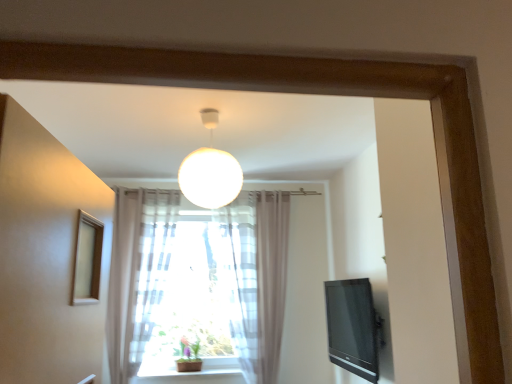
Measure the distance between black glossy tv at right and camera.

A distance of 3.31 meters exists between black glossy tv at right and camera.

Measure the distance between white matte sphere at center and camera.

The depth of white matte sphere at center is 7.97 feet.

Locate an element on the screen. black glossy tv at right is located at coordinates (352, 327).

Considering the relative sizes of black glossy tv at right and translucent fabric curtain at lower center in the image provided, is black glossy tv at right shorter than translucent fabric curtain at lower center?

Yes, black glossy tv at right is shorter than translucent fabric curtain at lower center.

How different are the orientations of black glossy tv at right and translucent fabric curtain at lower center in degrees?

90 degrees separate the facing orientations of black glossy tv at right and translucent fabric curtain at lower center.

Is the surface of black glossy tv at right in direct contact with translucent fabric curtain at lower center?

No, black glossy tv at right is not making contact with translucent fabric curtain at lower center.

Which point is more forward, (362,342) or (240,186)?

The point (240,186) is more forward.

Which object is further away from the camera, black glossy tv at right or white matte sphere at center?

black glossy tv at right is further away from the camera.

From the picture: From the image's perspective, does black glossy tv at right appear higher than white matte sphere at center?

No, from the image's perspective, black glossy tv at right is not on top of white matte sphere at center.

Measure the distance from black glossy tv at right to white matte sphere at center.

black glossy tv at right and white matte sphere at center are 6.28 feet apart.

Which object is thinner, green matte plant at center or translucent fabric curtain at lower center?

With smaller width is green matte plant at center.

Is translucent fabric curtain at lower center at the back of green matte plant at center?

No, green matte plant at center is not facing the opposite direction of translucent fabric curtain at lower center.

Image resolution: width=512 pixels, height=384 pixels. Find the location of `plant on the right of translucent fabric curtain at lower center`. plant on the right of translucent fabric curtain at lower center is located at coordinates (189, 351).

Relative to translucent fabric curtain at lower center, is green matte plant at center in front or behind?

green matte plant at center is behind translucent fabric curtain at lower center.

Is green matte plant at center touching white matte sphere at center?

No, green matte plant at center is not in contact with white matte sphere at center.

Between green matte plant at center and white matte sphere at center, which one has larger width?

With larger width is white matte sphere at center.

From a real-world perspective, is green matte plant at center physically above white matte sphere at center?

No, from a real-world perspective, green matte plant at center is not over white matte sphere at center

Does point (182, 340) come in front of point (205, 124)?

No, (182, 340) is behind (205, 124).

Is white matte sphere at center inside or outside of green matte plant at center?

white matte sphere at center is not enclosed by green matte plant at center.

Is white matte sphere at center further to camera compared to green matte plant at center?

No, the depth of white matte sphere at center is less than that of green matte plant at center.

From the image's perspective, relative to green matte plant at center, is white matte sphere at center above or below?

Based on their image positions, white matte sphere at center is located above green matte plant at center.

Which is in front, point (184, 170) or point (195, 342)?

Point (184, 170)

From the image's perspective, does translucent fabric curtain at lower center appear higher than green matte plant at center?

Correct, translucent fabric curtain at lower center appears higher than green matte plant at center in the image.

Is translucent fabric curtain at lower center smaller than green matte plant at center?

No, translucent fabric curtain at lower center is not smaller than green matte plant at center.

Is translucent fabric curtain at lower center outside of green matte plant at center?

Yes, translucent fabric curtain at lower center is not within green matte plant at center.

Could you tell me if white matte sphere at center is facing translucent fabric curtain at lower center?

No, white matte sphere at center is not aimed at translucent fabric curtain at lower center.

Which is more to the right, white matte sphere at center or translucent fabric curtain at lower center?

Positioned to the right is white matte sphere at center.

Is white matte sphere at center placed right next to translucent fabric curtain at lower center?

white matte sphere at center and translucent fabric curtain at lower center are not in contact.

You are a GUI agent. You are given a task and a screenshot of the screen. Output one action in this format:
    pyautogui.click(x=<x>, y=<y>)
    Task: Click on the curtain located on the left of black glossy tv at right
    
    Given the screenshot: What is the action you would take?
    pyautogui.click(x=138, y=273)

Locate an element on the screen. The width and height of the screenshot is (512, 384). lamp above the black glossy tv at right (from the image's perspective) is located at coordinates pos(210,171).

From the image, which object appears to be farther from green matte plant at center, translucent fabric curtain at lower center or white matte sphere at center?

Based on the image, white matte sphere at center appears to be further to green matte plant at center.

Looking at this image, from the image, which object appears to be nearer to green matte plant at center, black glossy tv at right or translucent fabric curtain at lower center?

translucent fabric curtain at lower center lies closer to green matte plant at center than the other object.

When comparing their distances from black glossy tv at right, does white matte sphere at center or translucent fabric curtain at lower center seem further?

white matte sphere at center lies further to black glossy tv at right than the other object.

Based on their spatial positions, is black glossy tv at right or translucent fabric curtain at lower center further from white matte sphere at center?

The object further to white matte sphere at center is black glossy tv at right.

Estimate the real-world distances between objects in this image. Which object is further from white matte sphere at center, translucent fabric curtain at lower center or green matte plant at center?

green matte plant at center.

Which object lies further to the anchor point translucent fabric curtain at lower center, black glossy tv at right or green matte plant at center?

Based on the image, black glossy tv at right appears to be further to translucent fabric curtain at lower center.

Looking at the image, which one is located further to white matte sphere at center, green matte plant at center or translucent fabric curtain at lower center?

green matte plant at center is further to white matte sphere at center.

From the image, which object appears to be nearer to black glossy tv at right, green matte plant at center or translucent fabric curtain at lower center?

green matte plant at center lies closer to black glossy tv at right than the other object.

Identify the location of lamp between translucent fabric curtain at lower center and black glossy tv at right from left to right. This screenshot has height=384, width=512. (210, 171).

Identify the location of plant situated between translucent fabric curtain at lower center and black glossy tv at right from left to right. The height and width of the screenshot is (384, 512). (189, 351).

Image resolution: width=512 pixels, height=384 pixels. What are the coordinates of `curtain positioned between white matte sphere at center and green matte plant at center from near to far` in the screenshot? It's located at (138, 273).

The width and height of the screenshot is (512, 384). Identify the location of television between white matte sphere at center and green matte plant at center in the vertical direction. (352, 327).